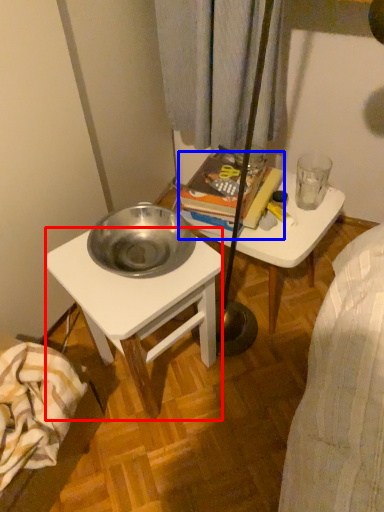
Question: Which of the following is the closest to the observer, desk (highlighted by a red box) or book (highlighted by a blue box)?

Choices:
 (A) desk
 (B) book

Answer: (A)